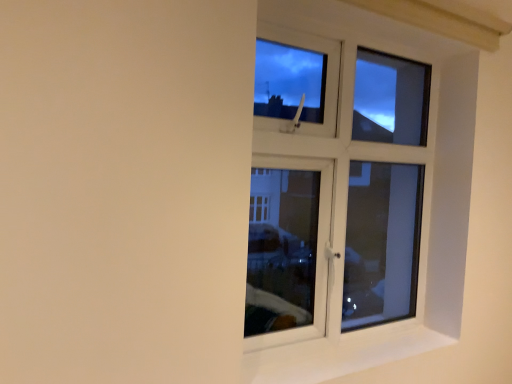
The image size is (512, 384). What do you see at coordinates (340, 353) in the screenshot? I see `white smooth window sill at right` at bounding box center [340, 353].

You are a GUI agent. You are given a task and a screenshot of the screen. Output one action in this format:
    pyautogui.click(x=<x>, y=<y>)
    Task: Click on the white smooth window sill at right
    
    Given the screenshot: What is the action you would take?
    (x=340, y=353)

This screenshot has width=512, height=384. What do you see at coordinates (336, 188) in the screenshot?
I see `white plastic window at upper right` at bounding box center [336, 188].

Where is `white plastic window at upper right`? The width and height of the screenshot is (512, 384). white plastic window at upper right is located at coordinates (336, 188).

Where is `white smooth window sill at right`? This screenshot has height=384, width=512. white smooth window sill at right is located at coordinates (340, 353).

Can you confirm if white smooth window sill at right is positioned to the right of white plastic window at upper right?

Indeed, white smooth window sill at right is positioned on the right side of white plastic window at upper right.

Does white smooth window sill at right come in front of white plastic window at upper right?

Yes, white smooth window sill at right is in front of white plastic window at upper right.

Is point (249, 364) closer to viewer compared to point (317, 57)?

Yes, it is in front of point (317, 57).

From the image's perspective, is white smooth window sill at right located above or below white plastic window at upper right?

white smooth window sill at right is situated lower than white plastic window at upper right in the image.

From a real-world perspective, is white smooth window sill at right beneath white plastic window at upper right?

Yes, from a real-world perspective, white smooth window sill at right is below white plastic window at upper right.

Does white smooth window sill at right have a lesser width compared to white plastic window at upper right?

No.

Considering the sizes of white smooth window sill at right and white plastic window at upper right in the image, is white smooth window sill at right taller or shorter than white plastic window at upper right?

Considering their sizes, white smooth window sill at right has less height than white plastic window at upper right.

Which of these two, white smooth window sill at right or white plastic window at upper right, is bigger?

white plastic window at upper right.

Based on the photo, is white smooth window sill at right outside of white plastic window at upper right?

Yes, white smooth window sill at right is located beyond the bounds of white plastic window at upper right.

Are white smooth window sill at right and white plastic window at upper right far apart?

That's right, there is a large distance between white smooth window sill at right and white plastic window at upper right.

Is white smooth window sill at right looking in the opposite direction of white plastic window at upper right?

Absolutely, white smooth window sill at right is directed away from white plastic window at upper right.

How different are the orientations of white smooth window sill at right and white plastic window at upper right in degrees?

The angle between the facing direction of white smooth window sill at right and the facing direction of white plastic window at upper right is 0.38 degrees.

Measure the distance between white smooth window sill at right and white plastic window at upper right.

white smooth window sill at right and white plastic window at upper right are 1.46 meters apart from each other.

What are the coordinates of `window on the left of white smooth window sill at right` in the screenshot? It's located at (336, 188).

Considering the positions of objects white plastic window at upper right and white smooth window sill at right in the image provided, who is more to the left, white plastic window at upper right or white smooth window sill at right?

white plastic window at upper right is more to the left.

Is white plastic window at upper right positioned before white smooth window sill at right?

That is False.

Does point (321, 37) appear closer or farther from the camera than point (380, 354)?

Point (321, 37) appears to be closer to the viewer than point (380, 354).

In the scene shown: From the image's perspective, is white plastic window at upper right positioned above or below white smooth window sill at right?

white plastic window at upper right is situated higher than white smooth window sill at right in the image.

From a real-world perspective, which object rests below the other?

In real-world perspective, white smooth window sill at right is lower.

Which of these two, white plastic window at upper right or white smooth window sill at right, is wider?

With larger width is white smooth window sill at right.

From their relative heights in the image, would you say white plastic window at upper right is taller or shorter than white smooth window sill at right?

white plastic window at upper right is taller than white smooth window sill at right.

Who is bigger, white plastic window at upper right or white smooth window sill at right?

Bigger between the two is white plastic window at upper right.

Is white plastic window at upper right inside or outside of white smooth window sill at right?

The correct answer is: outside.

From the picture: Is there a large distance between white plastic window at upper right and white smooth window sill at right?

Yes, white plastic window at upper right is far from white smooth window sill at right.

Based on the photo, is white plastic window at upper right aimed at white smooth window sill at right?

Yes, white plastic window at upper right is turned towards white smooth window sill at right.

Find the location of a particular element. Image resolution: width=512 pixels, height=384 pixels. window on the left of white smooth window sill at right is located at coordinates (336, 188).

Locate an element on the screen. This screenshot has width=512, height=384. window behind the white smooth window sill at right is located at coordinates (336, 188).

Find the location of a particular element. window above the white smooth window sill at right (from the image's perspective) is located at coordinates (336, 188).